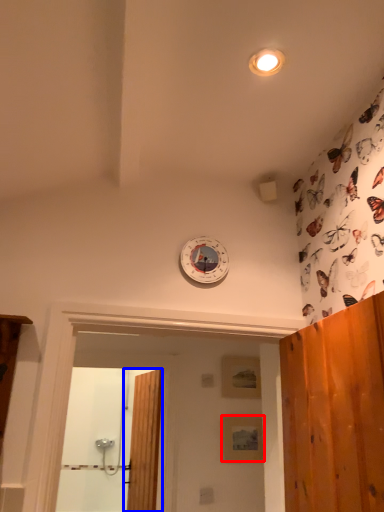
Question: Which object appears closest to the camera in this image, panel (highlighted by a red box) or door (highlighted by a blue box)?

Choices:
 (A) panel
 (B) door

Answer: (B)